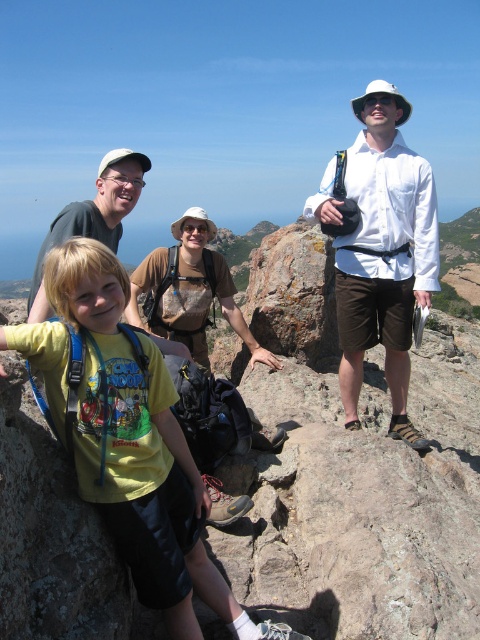
You are a photographer standing at the center of the scene. You want to take a photo that includes both the yellow cotton shirt at center and the brown canvas backpack at center. Given that your camera has a maximum focus range of 4 meters, will you be able to capture both objects in focus without moving?

The distance between the yellow cotton shirt at center and the brown canvas backpack at center is 4.30 meters. Since the camera can only focus within 4 meters, the two objects are too far apart to be both in focus simultaneously. You would need to adjust your position or use a different camera setting.

Looking at this image, you are a photographer trying to capture the best shot of the two subjects in the scene. The subjects are wearing a yellow cotton shirt at center and a matte green shirt at center. Based on their positions, which one should you focus on first to ensure they are in sharp focus?

You should focus on the yellow cotton shirt at center first because it is closer to the viewer than the matte green shirt at center, so focusing on the closer subject ensures sharpness before adjusting for the other.